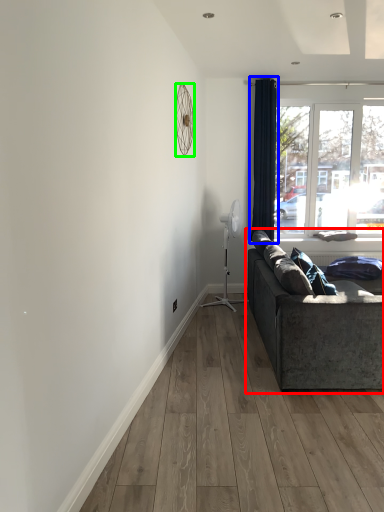
Question: Which is farther away from studio couch (highlighted by a red box)? curtain (highlighted by a blue box) or mechanical fan (highlighted by a green box)?

Choices:
 (A) curtain
 (B) mechanical fan

Answer: (A)